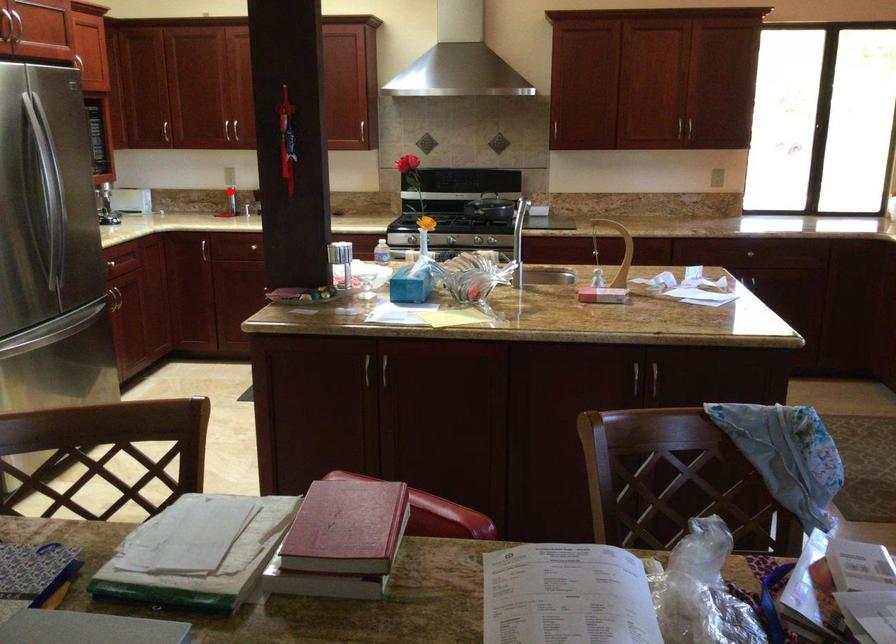
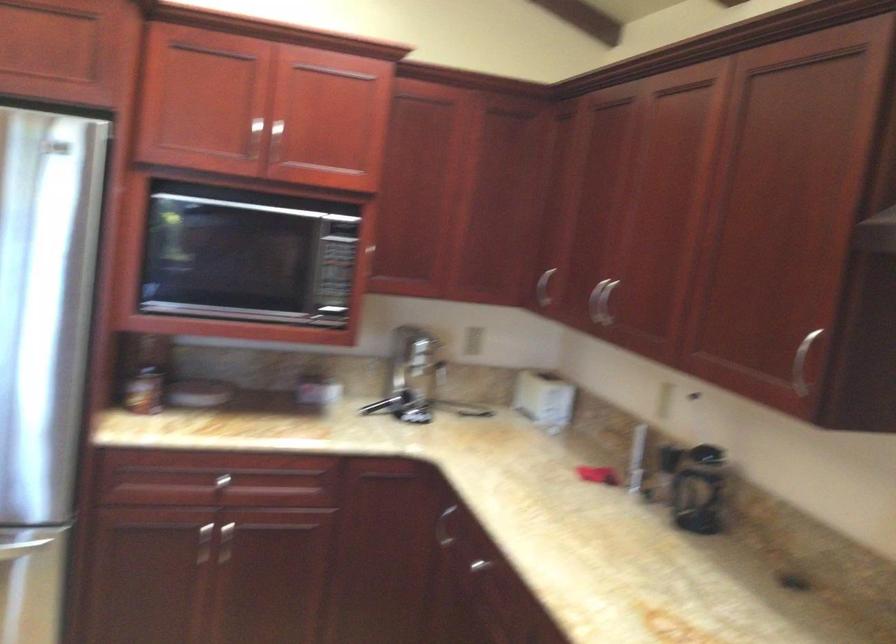
The point at the highlighted location is marked in the first image. Where is the corresponding point in the second image?

(699, 489)